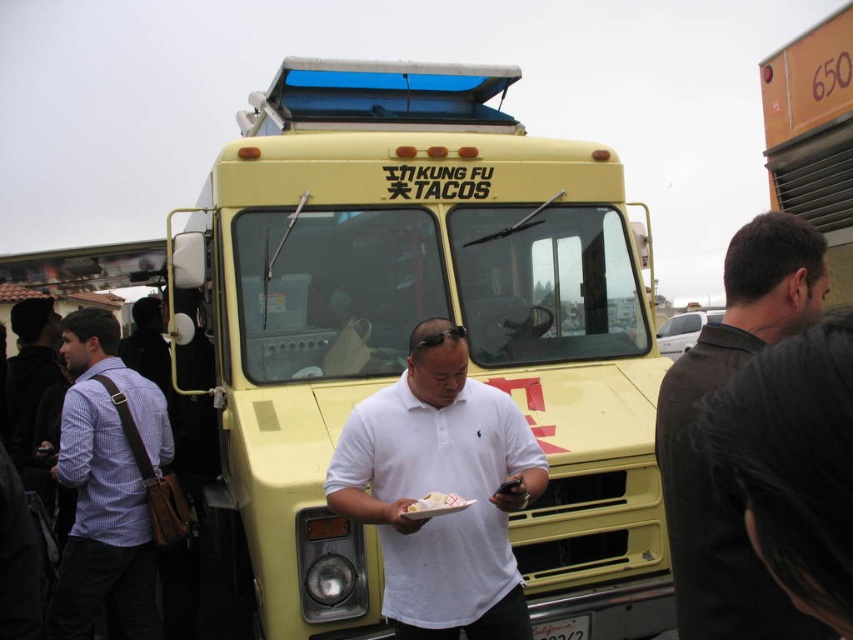
You are a customer at the event and want to find the main food truck. Which one is more to the left between the yellow matte food truck at center and the yellow plastic food truck at upper right?

The yellow matte food truck at center is more to the left than the yellow plastic food truck at upper right.

You are standing at the point marked as point (813, 134) in the image. What object is located at that point?

The point (813, 134) marks the yellow plastic food truck at upper right.